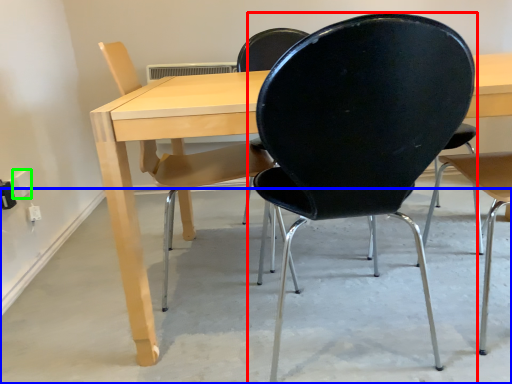
Question: Based on their relative distances, which object is farther from chair (highlighted by a red box)? Choose from concrete (highlighted by a blue box) and electric outlet (highlighted by a green box).

Choices:
 (A) concrete
 (B) electric outlet

Answer: (B)